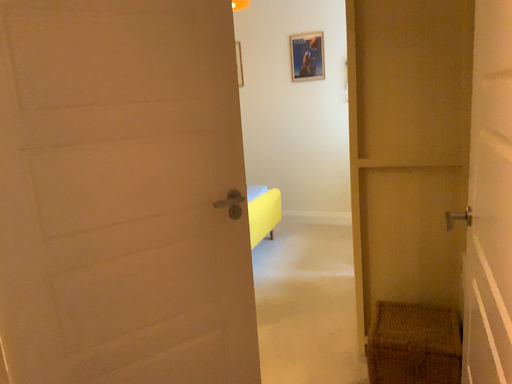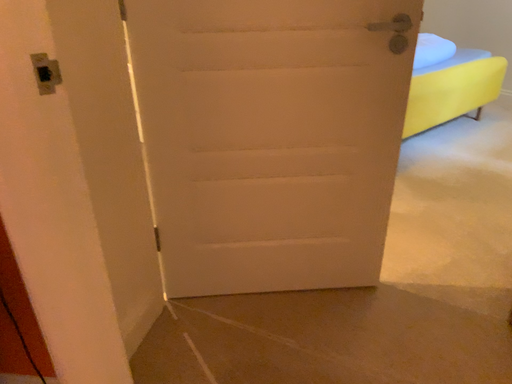
Question: Which way did the camera rotate in the video?

Choices:
 (A) rotated right
 (B) rotated left

Answer: (B)